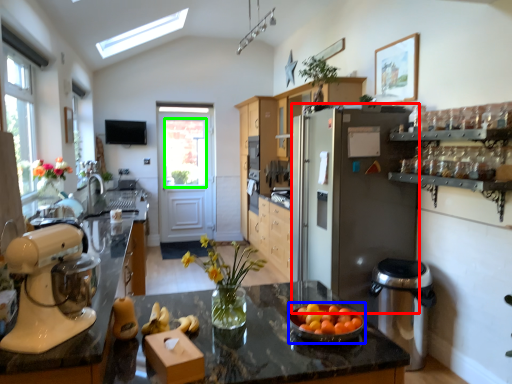
Question: Based on their relative distances, which object is nearer to refrigerator (highlighted by a red box)? Choose from tableware (highlighted by a blue box) and window screen (highlighted by a green box).

Choices:
 (A) tableware
 (B) window screen

Answer: (A)